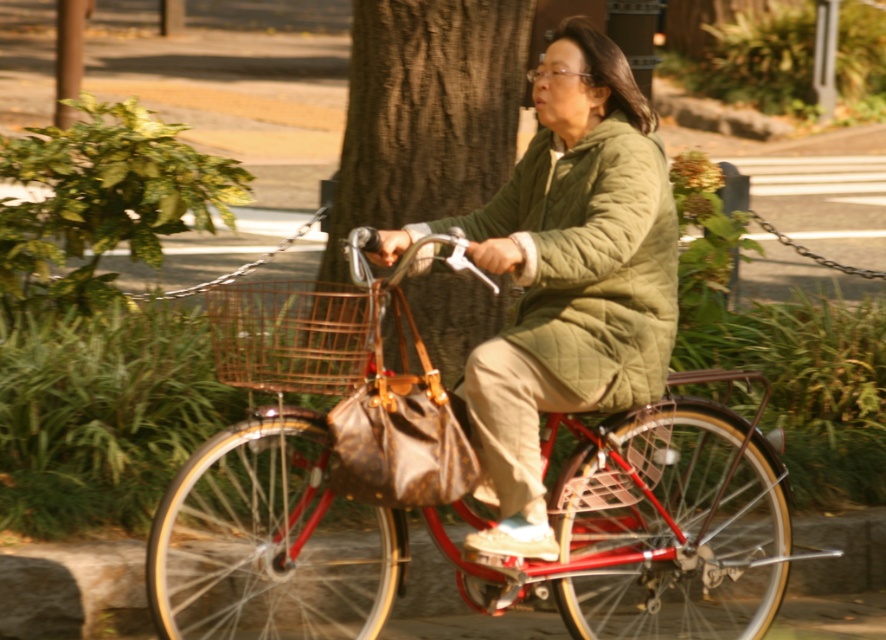
Based on the photo, you are a photographer trying to capture a clear shot of the quilted olive green coat at center and the rusty metal basket at center. Since both are at the center, which one will appear larger in your photo?

The quilted olive green coat at center is much taller than the rusty metal basket at center, so it will appear larger in the photo.

Consider the image. You are a photographer trying to capture the rusty metal basket at center and the brown textured tree trunk at center in a single shot. Based on their positions, can you tell which object is closer to the camera?

The rusty metal basket at center is behind the brown textured tree trunk at center, so the brown textured tree trunk at center is closer to the camera.

You are standing in the park and see two points marked on the ground. The first point is at coordinates point (298, 324) and the second is at point (431, 120). Which point is closer to you?

Point (298, 324) is closer to the viewer than point (431, 120).